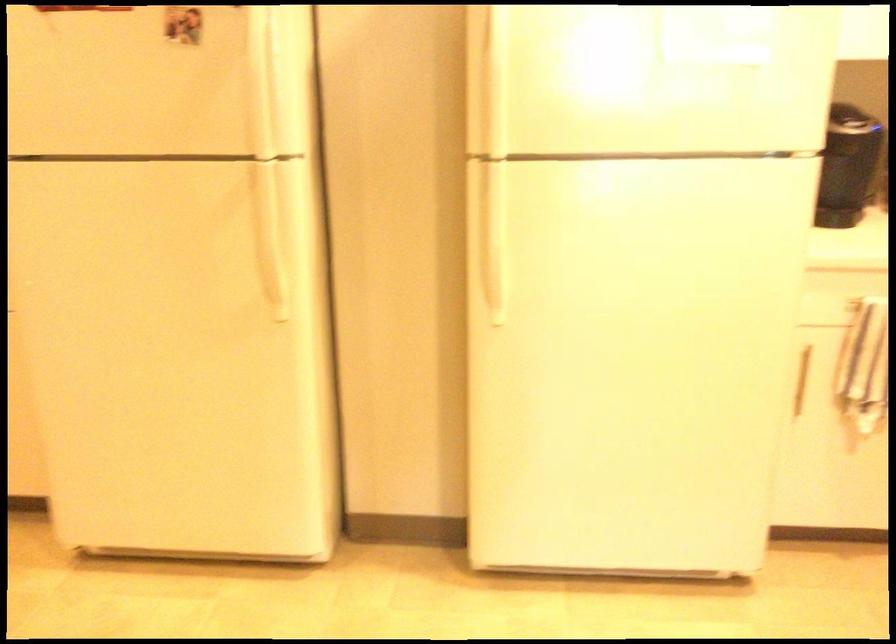
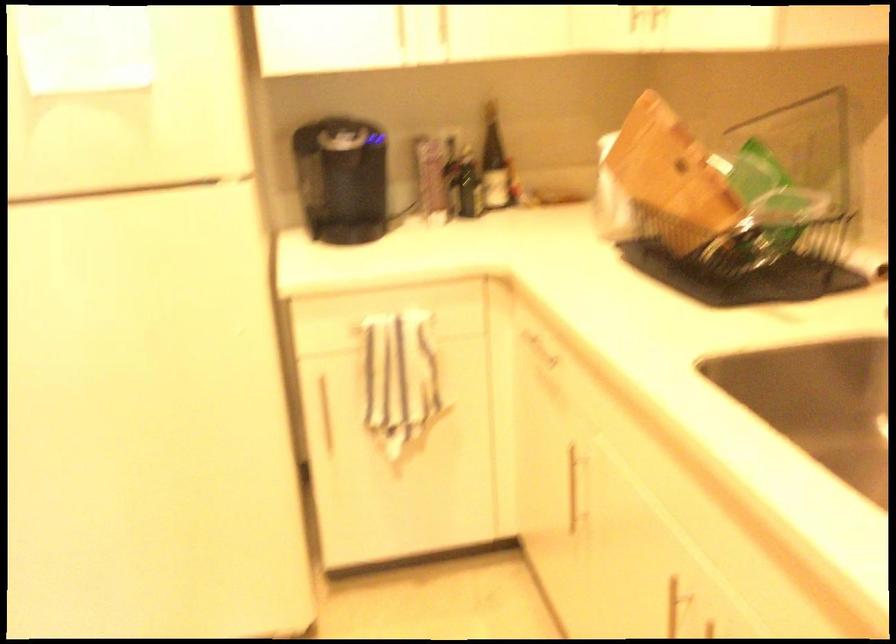
Question: In a continuous first-person perspective shot, in which direction is the camera moving?

Choices:
 (A) Left
 (B) Right
 (C) Forward
 (D) Backward

Answer: (B)